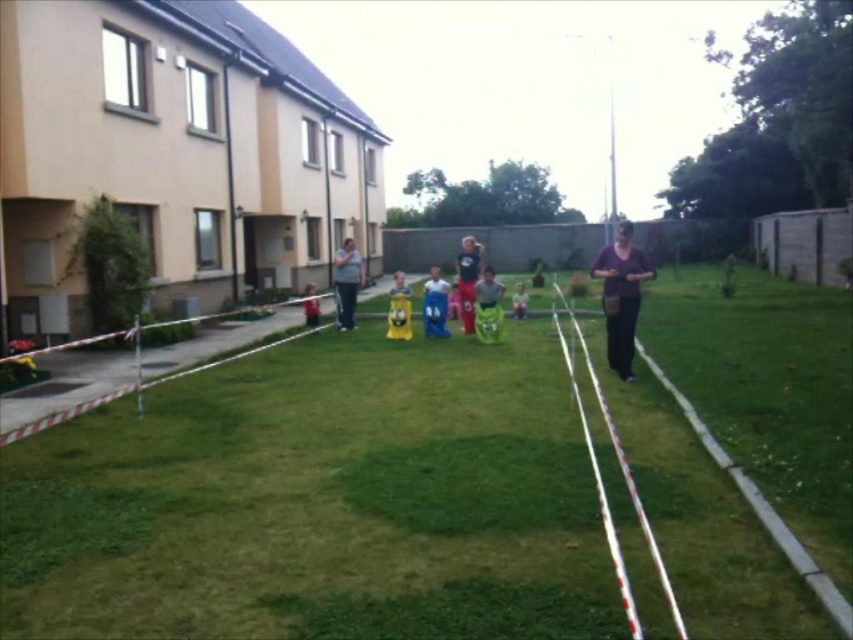
Question: Which point is farther to the camera?

Choices:
 (A) white plastic tape at center
 (B) yellow fabric at center
 (C) green grass at center
 (D) yellow fabric child at center

Answer: (D)

Question: In this image, where is white plastic tape at center located relative to yellow fabric at center?

Choices:
 (A) above
 (B) below

Answer: (B)

Question: Which of these objects is positioned farthest from the red fabric child at center?

Choices:
 (A) white plastic tape at center
 (B) yellow fabric child at center
 (C) matte black shirt at center
 (D) yellow fabric at center

Answer: (A)

Question: Does green grass at center appear under matte gray shirt at center?

Choices:
 (A) yes
 (B) no

Answer: (A)

Question: Does white plastic tape at center have a greater width compared to matte blue shorts at center?

Choices:
 (A) yes
 (B) no

Answer: (A)

Question: Which object is closer to the camera taking this photo?

Choices:
 (A) matte blue shorts at center
 (B) matte gray shirt at center
 (C) yellow fabric at center

Answer: (B)